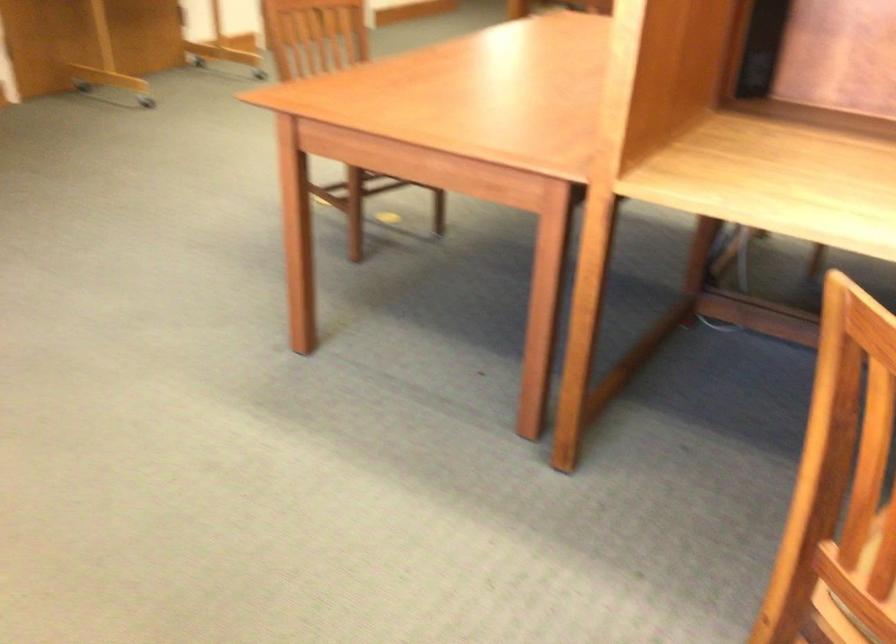
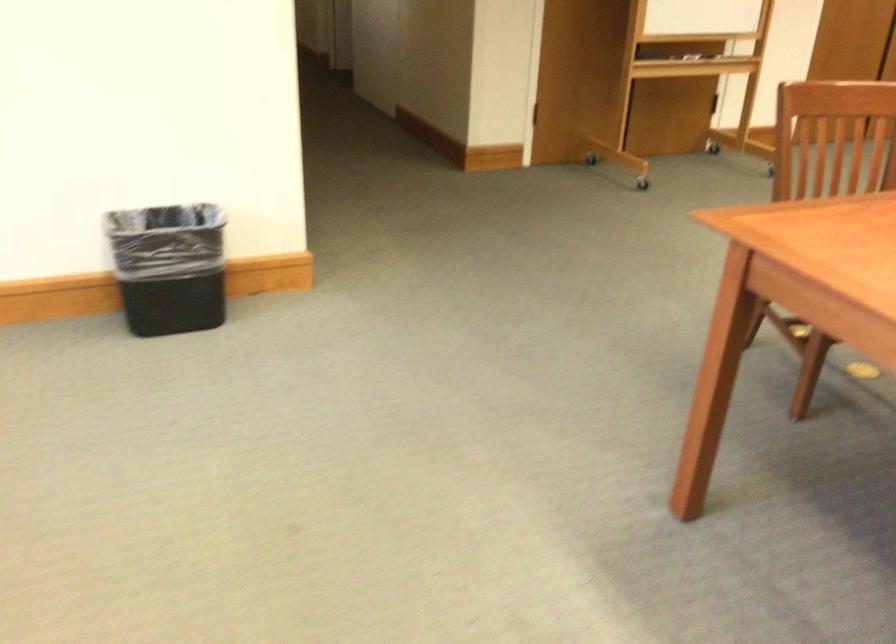
Locate, in the second image, the point that corresponds to the point at 100,76 in the first image.

(595, 153)